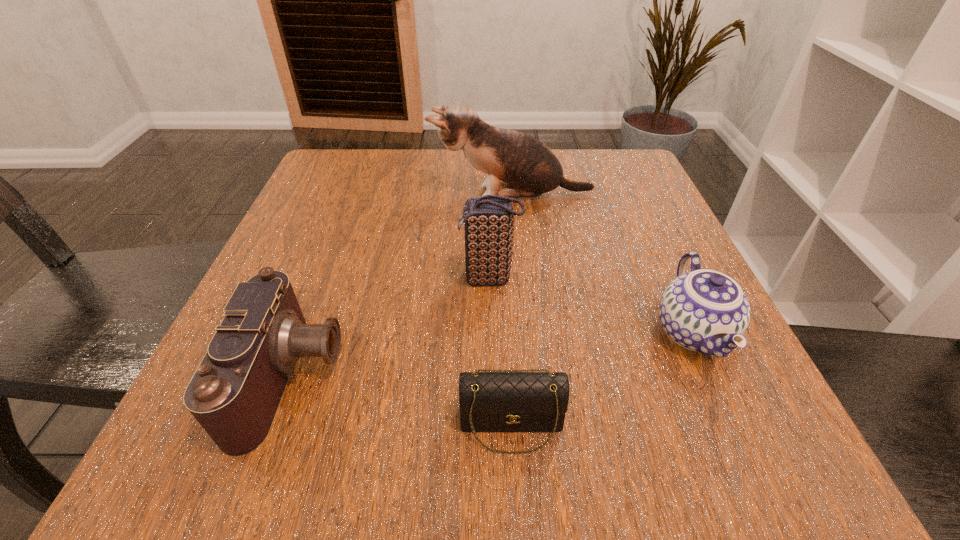
What are the coordinates of `the farthest object` in the screenshot? It's located at (528, 168).

This screenshot has width=960, height=540. What are the coordinates of `the taller clutch bag` in the screenshot? It's located at (489, 220).

I want to click on the second tallest object, so click(489, 220).

Where is `the leftmost object`? the leftmost object is located at coordinates (236, 390).

At what (x,y) coordinates should I click in order to perform the action: click on the rightmost object. Please return your answer as a coordinate pair (x, y). The image size is (960, 540). Looking at the image, I should click on (704, 310).

Locate an element on the screen. Image resolution: width=960 pixels, height=540 pixels. the nearer clutch bag is located at coordinates (497, 400).

Locate an element on the screen. the shortest object is located at coordinates (497, 400).

I want to click on free region located 0.250m at the face of the farthest object, so click(316, 195).

Identify the location of free space located 0.070m at the face of the farthest object. This screenshot has height=540, width=960. (399, 195).

Find the location of a particular element. The height and width of the screenshot is (540, 960). free location located at the face of the farthest object is located at coordinates (312, 195).